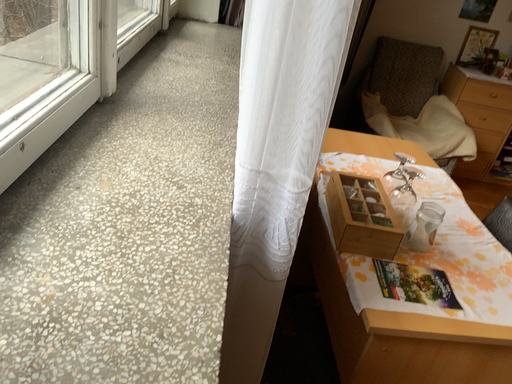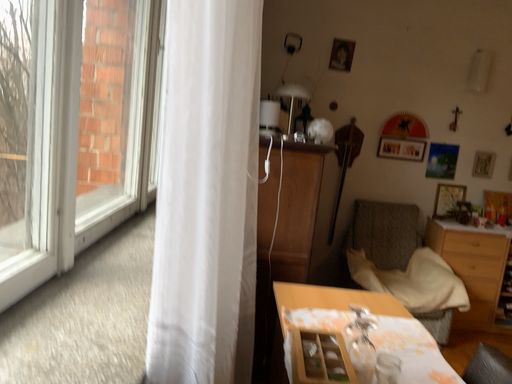
Question: Which way did the camera rotate in the video?

Choices:
 (A) rotated upward
 (B) rotated downward

Answer: (A)